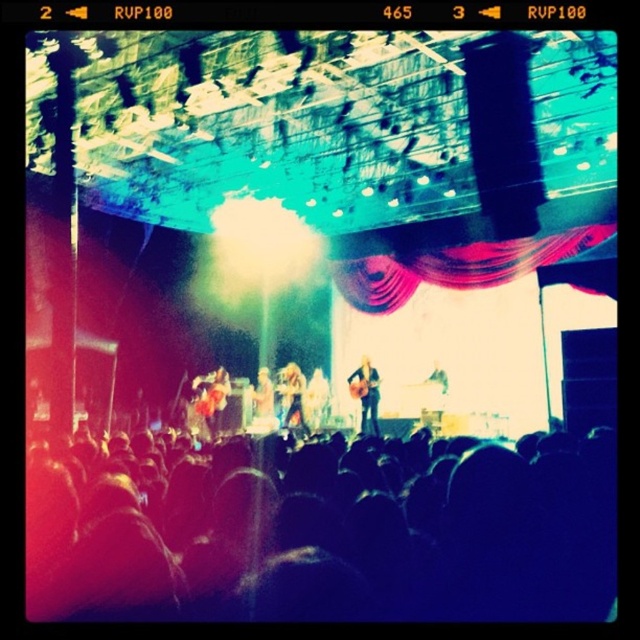
Is black matte crowd at lower center shorter than pink satin curtain at center?

Indeed, black matte crowd at lower center has a lesser height compared to pink satin curtain at center.

Who is more distant from viewer, [358,499] or [417,266]?

Point [417,266]

Which is behind, point (419, 547) or point (499, 276)?

The point (499, 276) is behind.

Locate an element on the screen. The width and height of the screenshot is (640, 640). black matte crowd at lower center is located at coordinates (332, 536).

Is shiny red guitar at center smaller than smooth skin figure at center?

Actually, shiny red guitar at center might be larger than smooth skin figure at center.

Between shiny red guitar at center and smooth skin figure at center, which one appears on the left side from the viewer's perspective?

shiny red guitar at center

Between point (220, 404) and point (268, 422), which one is positioned behind?

Positioned behind is point (268, 422).

The image size is (640, 640). In order to click on shiny red guitar at center in this screenshot , I will do `click(211, 397)`.

Which of these two, shiny red guitar at center or shiny silver guitar at center, stands shorter?

With less height is shiny silver guitar at center.

Between point (211, 385) and point (284, 420), which one is positioned in front?

Point (284, 420)

At what (x,y) coordinates should I click in order to perform the action: click on shiny red guitar at center. Please return your answer as a coordinate pair (x, y). Image resolution: width=640 pixels, height=640 pixels. Looking at the image, I should click on (211, 397).